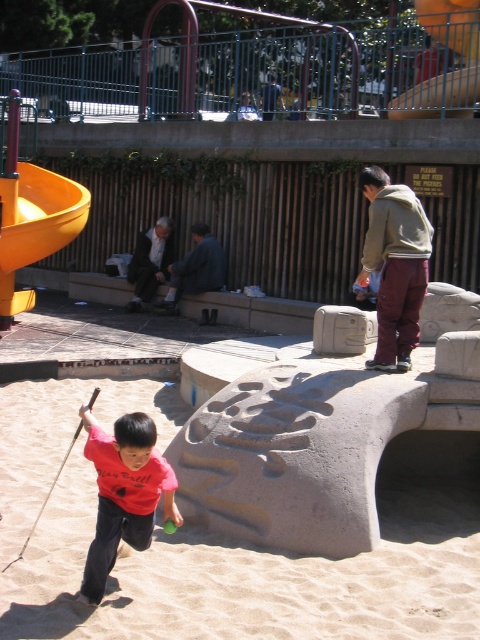
Looking at this image, you are a parent supervising children at the playground. You notice the yellow plastic slide at upper center and the white fabric pants at center. Which object is located above the other?

The yellow plastic slide at upper center is positioned over the white fabric pants at center, so it is located above the white fabric pants at center.

You are a parent trying to locate your child who is wearing a red cotton shirt at lower left. The yellow plastic slide at upper center is a meeting point. Can you walk directly to the slide from the shirt without obstacles?

The distance between the red cotton shirt at lower left and the yellow plastic slide at upper center is 7.91 meters. Since there are no mentioned obstacles in the scene description, you can walk directly to the slide from the shirt.

You are a parent at the playground and want to ensure your child stays within a safe area. The yellow plastic slide at upper center and the white fabric pants at center are both in the vicinity. Which object is shorter and therefore safer for your child to avoid climbing?

The yellow plastic slide at upper center is shorter than the white fabric pants at center, so it is safer for the child to avoid climbing the slide.